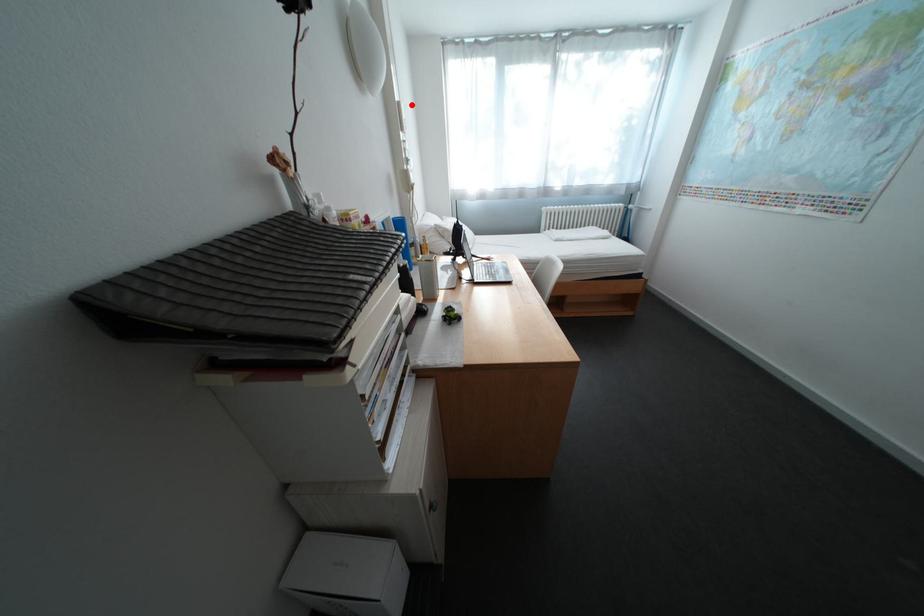
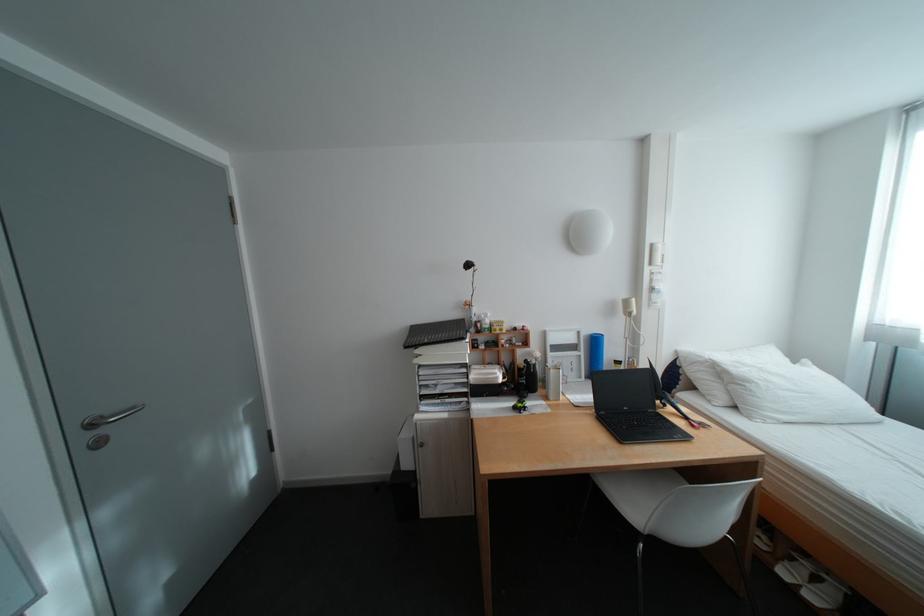
Question: I am providing you with two images of the same scene from different viewpoints. In image1, a red point is highlighted. Considering the same 3D point in image2, which of the following is correct?

Choices:
 (A) It is closer
 (B) It is farther

Answer: (B)